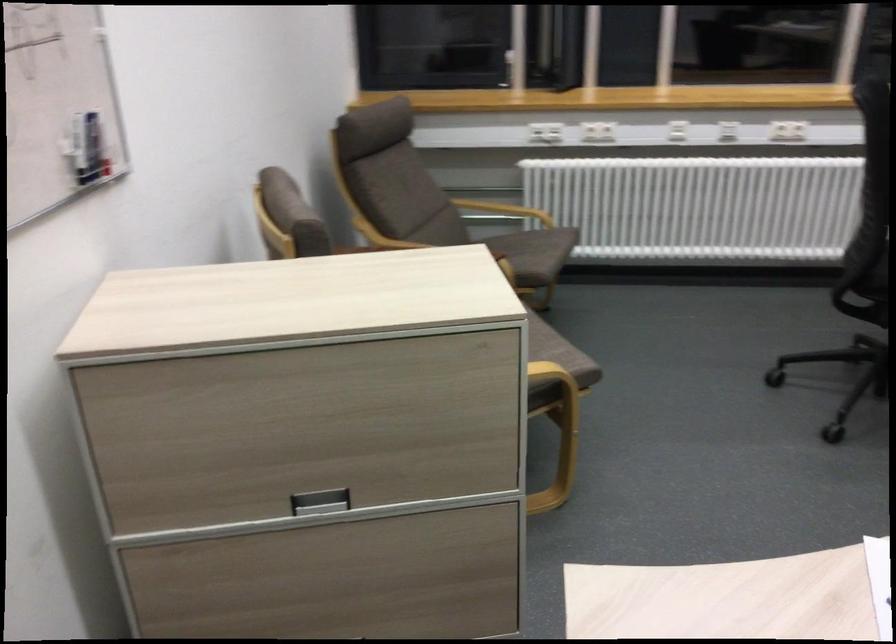
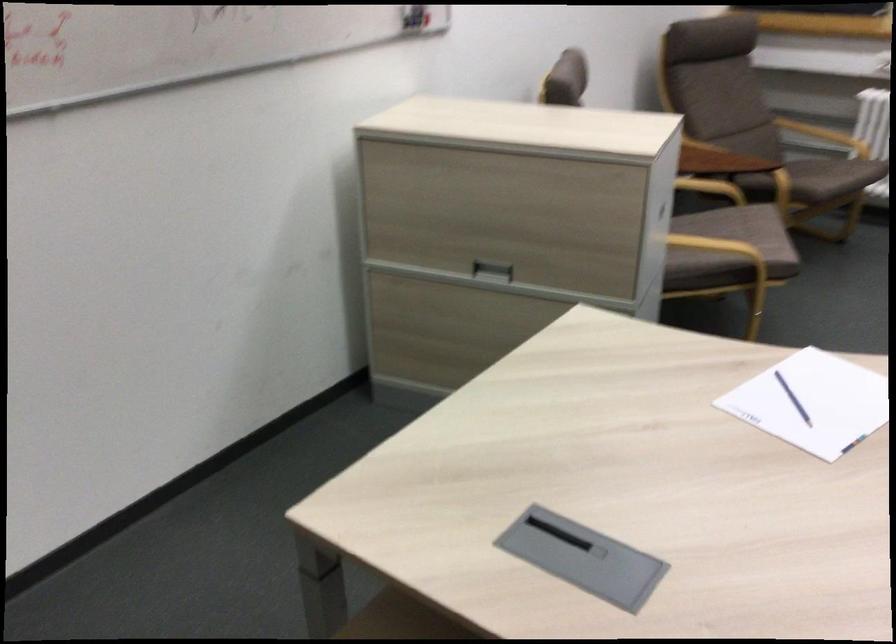
The point at (322, 502) is marked in the first image. Where is the corresponding point in the second image?

(492, 270)